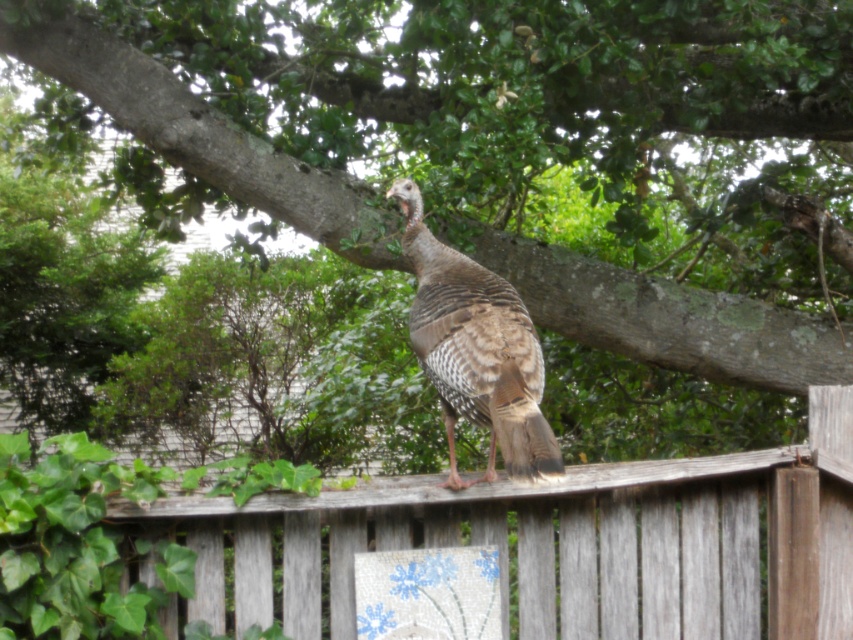
You are a birdwatcher trying to capture a clear photo of the wild turkey on the weathered wood fence at upper center. Your camera has a zoom lens that can focus on objects within a 0.6 radius from the center point. Is the turkey within the focus range of your camera if you center your view at coordinates 0.7, 0.6?

The weathered wood fence at upper center is located at coordinates (554, 545). The distance between the center point (511, 448) and the turkey on the weathered wood fence at upper center is sqrt of squared difference between 0.852 and 0.7 plus squared difference between 0.651 and 0.6. Calculating that gives sqrt of 0.022849 plus 0.002581 equals sqrt of 0.02543, which is approximately 0.1596. Since 0.1596 is less than 0.6, the turkey is within the focus range.

Based on the scene, which object is bigger between the weathered wood fence at upper center and the brown speckled feathers at center?

The weathered wood fence at upper center is larger in size compared to the brown speckled feathers at center.